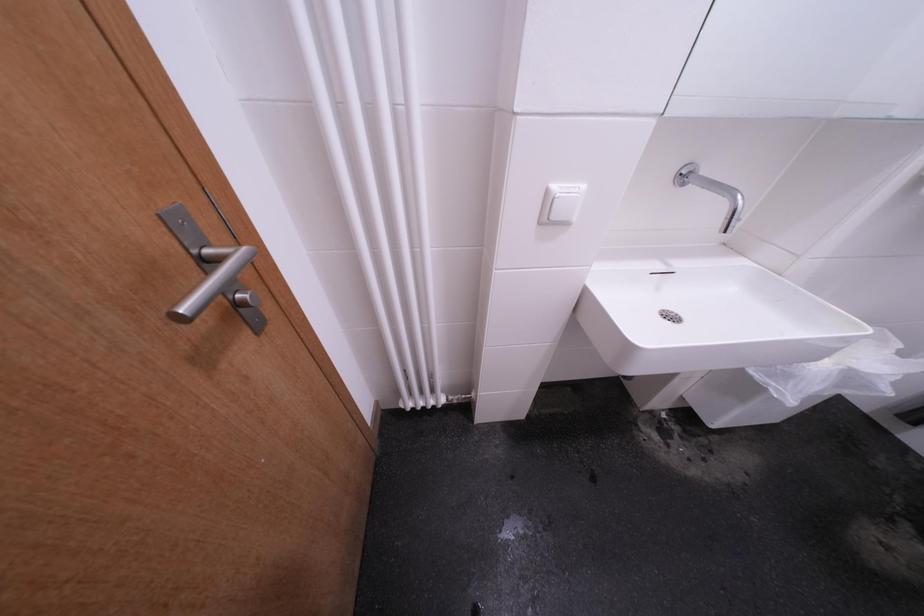
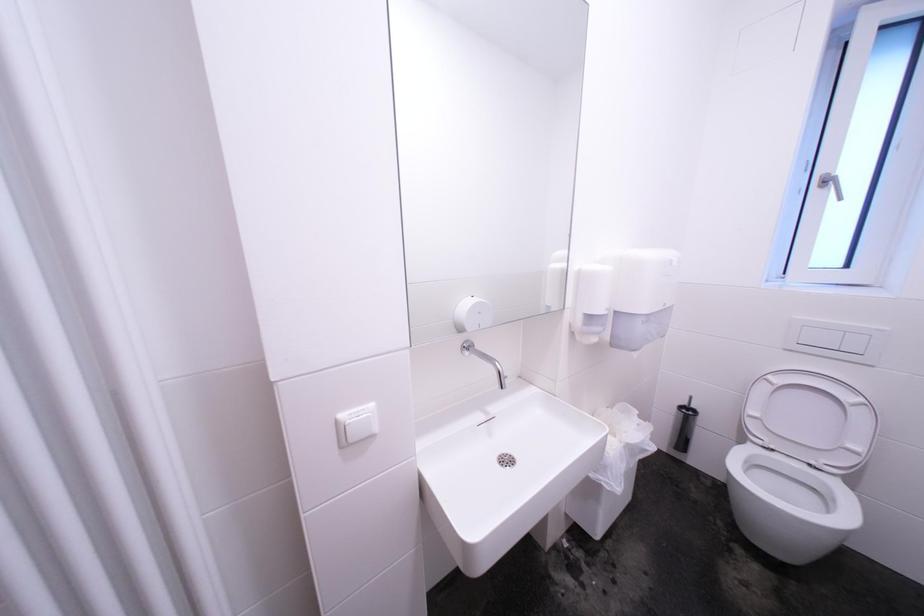
The first image is from the beginning of the video and the second image is from the end. How did the camera likely rotate when shooting the video?

The camera rotated toward right-up.